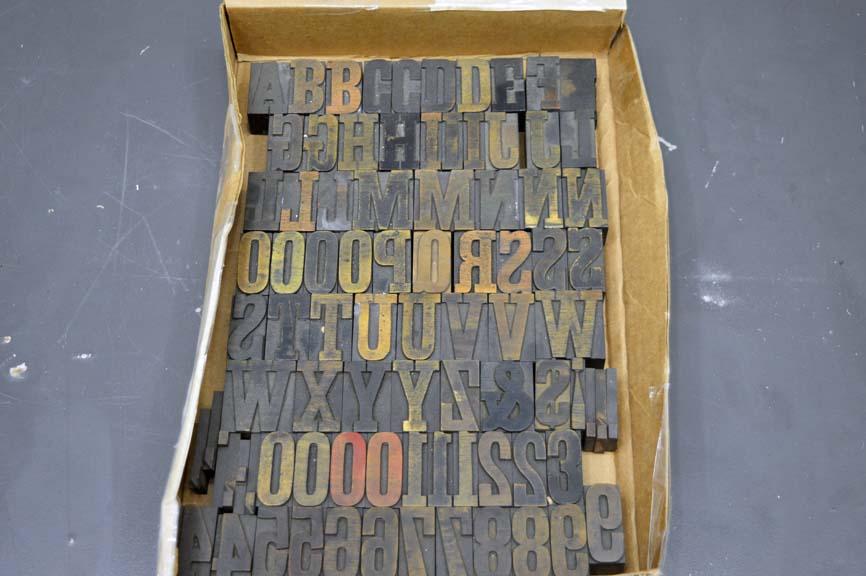
Image resolution: width=866 pixels, height=576 pixels. Identify the location of the bottom of inside of box. (225, 283).